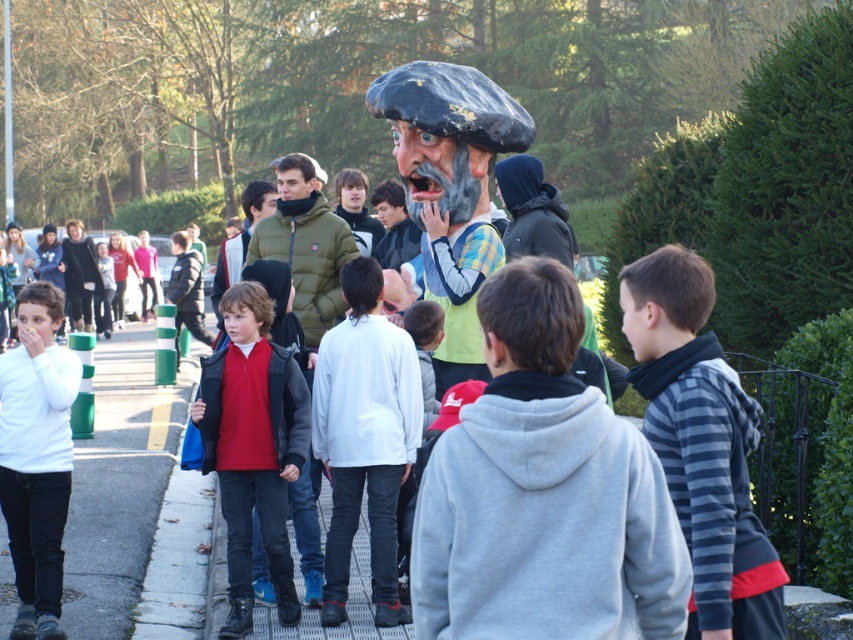
Based on the photo, you are a photographer at the event and want to capture both the matte red shirt at center and the white matte sweater at left in a single frame. Based on their positions, which one should you focus on first to ensure both are in the shot?

The matte red shirt at center is to the right of the white matte sweater at left, so you should focus on the white matte sweater at left first to ensure both are in the shot.

You are a photographer trying to capture a group photo of the white matte jacket at center and the matte red shirt at center. The camera you are using has a minimum focus distance of 16 inches. Can you take the photo without moving either of them?

The distance between the white matte jacket at center and the matte red shirt at center is 16.46 inches, which is just over the camera minimum focus distance of 16 inches. Therefore, you can take the photo without moving either of them.